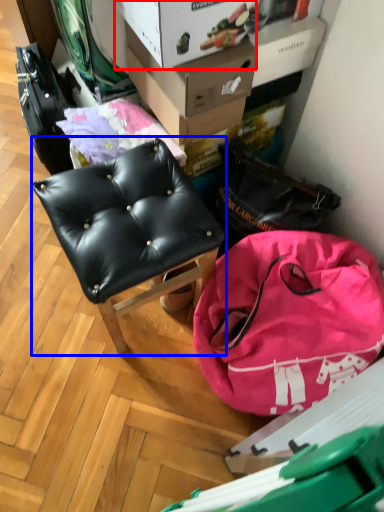
Question: Which of the following is the closest to the observer, cardboard box (highlighted by a red box) or chair (highlighted by a blue box)?

Choices:
 (A) cardboard box
 (B) chair

Answer: (B)